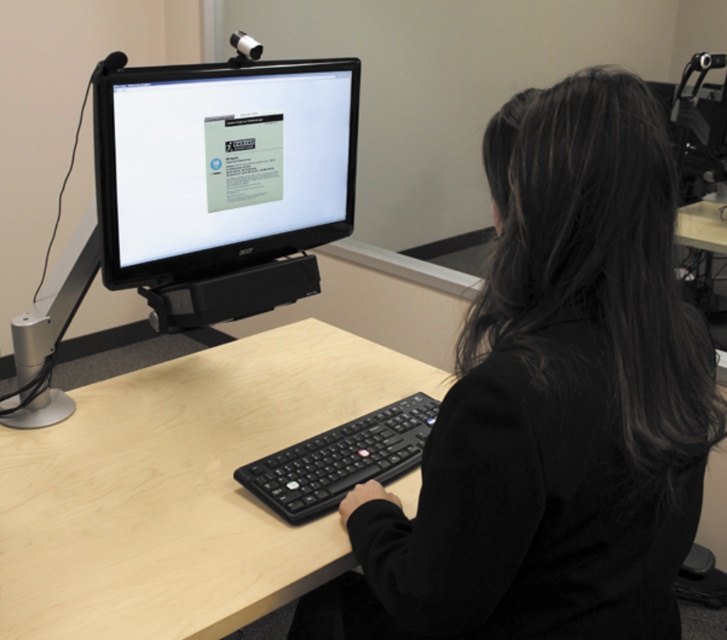
Is point (172, 458) closer to camera compared to point (268, 488)?

No, it is behind (268, 488).

The width and height of the screenshot is (727, 640). What do you see at coordinates (180, 488) in the screenshot? I see `light wood/black keyboard at center` at bounding box center [180, 488].

Where is `light wood/black keyboard at center`? This screenshot has height=640, width=727. light wood/black keyboard at center is located at coordinates (180, 488).

Does black matte keyboard at center have a lesser height compared to light wood/black keyboard at center?

No, black matte keyboard at center is not shorter than light wood/black keyboard at center.

Between black matte keyboard at center and light wood/black keyboard at center, which one is positioned higher?

Positioned higher is black matte keyboard at center.

Between point (518, 323) and point (12, 474), which one is positioned in front?

Point (518, 323) is in front.

Where is `black matte keyboard at center`? black matte keyboard at center is located at coordinates (553, 403).

Is point (441, 388) behind point (254, 221)?

Yes, point (441, 388) is behind point (254, 221).

Can you confirm if light wood/black keyboard at center is positioned to the left of matte black monitor at center?

Correct, you'll find light wood/black keyboard at center to the left of matte black monitor at center.

What do you see at coordinates (180, 488) in the screenshot? I see `light wood/black keyboard at center` at bounding box center [180, 488].

Find the location of a particular element. The height and width of the screenshot is (640, 727). light wood/black keyboard at center is located at coordinates (180, 488).